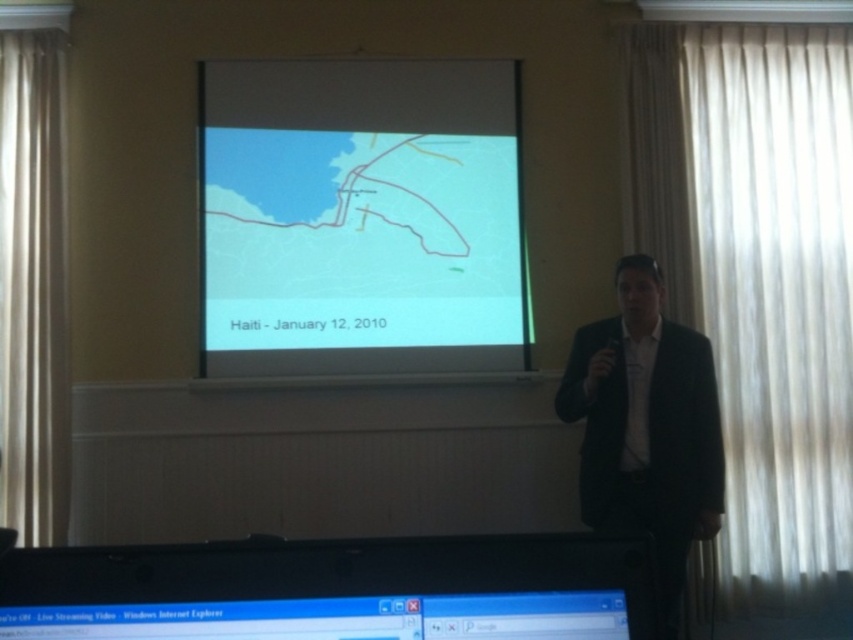
Between matte map at center and black plastic monitor at lower center, which one is positioned lower?

black plastic monitor at lower center is lower down.

Is matte map at center shorter than black plastic monitor at lower center?

No, matte map at center is not shorter than black plastic monitor at lower center.

Is point (434, 225) farther from camera compared to point (184, 620)?

Yes, it is.

The width and height of the screenshot is (853, 640). Identify the location of matte map at center. (361, 218).

Where is `black plastic monitor at lower center`? This screenshot has width=853, height=640. black plastic monitor at lower center is located at coordinates (334, 589).

Who is positioned more to the right, black plastic monitor at lower center or black suit at right?

From the viewer's perspective, black suit at right appears more on the right side.

This screenshot has width=853, height=640. Identify the location of black plastic monitor at lower center. (334, 589).

Can you confirm if matte map at center is positioned below black suit at right?

No, matte map at center is not below black suit at right.

Is matte map at center positioned in front of black suit at right?

No, matte map at center is behind black suit at right.

Locate an element on the screen. matte map at center is located at coordinates (361, 218).